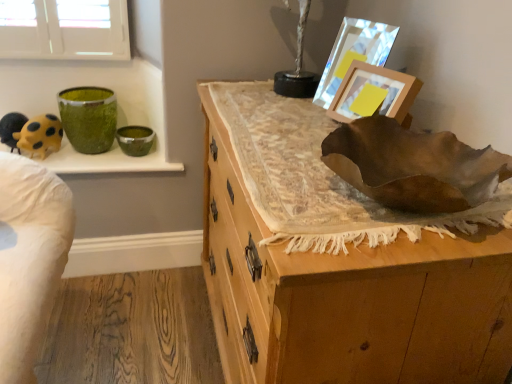
Measure the distance between point (27,150) and camera.

They are 1.55 meters apart.

Locate an element on the screen. The image size is (512, 384). green textured vase at upper left is located at coordinates (88, 118).

Locate an element on the screen. Image resolution: width=512 pixels, height=384 pixels. wooden picture frame at upper right, the second picture frame from the back is located at coordinates (375, 91).

Describe the element at coordinates (135, 140) in the screenshot. I see `green glossy bowl at upper left` at that location.

Locate an element on the screen. This screenshot has width=512, height=384. yellow matte toy at upper left is located at coordinates (40, 135).

Is green textured vase at upper left closer to the viewer compared to wooden chest of drawers at center?

No, it is not.

Is point (63, 115) closer or farther from the camera than point (277, 311)?

Point (63, 115) is positioned farther from the camera compared to point (277, 311).

Considering the relative sizes of green textured vase at upper left and wooden chest of drawers at center in the image provided, is green textured vase at upper left thinner than wooden chest of drawers at center?

Indeed, green textured vase at upper left has a lesser width compared to wooden chest of drawers at center.

Can you tell me how much green textured vase at upper left and wooden chest of drawers at center differ in facing direction?

The angular difference between green textured vase at upper left and wooden chest of drawers at center is 89.4 degrees.

Considering the sizes of objects green glossy bowl at upper left and yellow matte toy at upper left in the image provided, who is thinner, green glossy bowl at upper left or yellow matte toy at upper left?

green glossy bowl at upper left is thinner.

In the scene shown: Could you tell me if green glossy bowl at upper left is facing yellow matte toy at upper left?

No.

At what (x,y) coordinates should I click in order to perform the action: click on glass bowl that appears on the left of wooden chest of drawers at center. Please return your answer as a coordinate pair (x, y). The image size is (512, 384). Looking at the image, I should click on click(x=135, y=140).

Is green glossy bowl at upper left turned away from wooden chest of drawers at center?

No.

Considering the sizes of objects green glossy bowl at upper left and wooden chest of drawers at center in the image provided, who is bigger, green glossy bowl at upper left or wooden chest of drawers at center?

With larger size is wooden chest of drawers at center.

From a real-world perspective, which is physically above, green glossy bowl at upper left or wooden chest of drawers at center?

In real-world perspective, green glossy bowl at upper left is above.

From a real-world perspective, is green textured vase at upper left above or below wooden picture frame at upper right, the second picture frame from the back?

green textured vase at upper left is situated lower than wooden picture frame at upper right, the second picture frame from the back, in the real world.

Considering the sizes of green textured vase at upper left and wooden picture frame at upper right, the first picture frame positioned from the front, in the image, is green textured vase at upper left taller or shorter than wooden picture frame at upper right, the first picture frame positioned from the front,?

Considering their sizes, green textured vase at upper left has more height than wooden picture frame at upper right, the first picture frame positioned from the front.

Looking at this image, could you tell me if green textured vase at upper left is facing wooden picture frame at upper right, the first picture frame positioned from the front?

No, green textured vase at upper left does not turn towards wooden picture frame at upper right, the first picture frame positioned from the front.

Can you confirm if green textured vase at upper left is positioned to the left of wooden picture frame at upper right, the first picture frame positioned from the front?

Correct, you'll find green textured vase at upper left to the left of wooden picture frame at upper right, the first picture frame positioned from the front.

Considering the sizes of wooden chest of drawers at center and metallic reflective picture frame at upper right, which is counted as the 1th picture frame, starting from the back, in the image, is wooden chest of drawers at center wider or thinner than metallic reflective picture frame at upper right, which is counted as the 1th picture frame, starting from the back,?

Clearly, wooden chest of drawers at center has more width compared to metallic reflective picture frame at upper right, which is counted as the 1th picture frame, starting from the back.

Which is closer to the camera, [457,227] or [341,79]?

Positioned in front is point [457,227].

Is wooden chest of drawers at center in contact with metallic reflective picture frame at upper right, which is counted as the 1th picture frame, starting from the back?

No, wooden chest of drawers at center is not with metallic reflective picture frame at upper right, which is counted as the 1th picture frame, starting from the back.

Is wooden chest of drawers at center surrounding metallic reflective picture frame at upper right, which is counted as the 1th picture frame, starting from the back?

Actually, metallic reflective picture frame at upper right, which is counted as the 1th picture frame, starting from the back, is outside wooden chest of drawers at center.

Considering the sizes of objects yellow matte toy at upper left and wooden chest of drawers at center in the image provided, who is bigger, yellow matte toy at upper left or wooden chest of drawers at center?

Bigger between the two is wooden chest of drawers at center.

In the scene shown: Is yellow matte toy at upper left taller than wooden chest of drawers at center?

In fact, yellow matte toy at upper left may be shorter than wooden chest of drawers at center.

Is yellow matte toy at upper left oriented towards wooden chest of drawers at center?

No, yellow matte toy at upper left is not turned towards wooden chest of drawers at center.

From the image's perspective, is yellow matte toy at upper left located above or below wooden chest of drawers at center?

yellow matte toy at upper left is situated higher than wooden chest of drawers at center in the image.

From the image's perspective, is metallic reflective picture frame at upper right, which is counted as the 1th picture frame, starting from the back, positioned above or below wooden picture frame at upper right, the second picture frame from the back?

From the image's perspective, metallic reflective picture frame at upper right, which is counted as the 1th picture frame, starting from the back, appears above wooden picture frame at upper right, the second picture frame from the back.

Can you confirm if metallic reflective picture frame at upper right, which appears as the 2th picture frame when viewed from the front, is smaller than wooden picture frame at upper right, the second picture frame from the back?

Actually, metallic reflective picture frame at upper right, which appears as the 2th picture frame when viewed from the front, might be larger than wooden picture frame at upper right, the second picture frame from the back.

Can you see metallic reflective picture frame at upper right, which is counted as the 1th picture frame, starting from the back, touching wooden picture frame at upper right, the first picture frame positioned from the front?

They are not placed beside each other.

Where is `chest of drawers on the right of green textured vase at upper left`? chest of drawers on the right of green textured vase at upper left is located at coordinates (340, 261).

The width and height of the screenshot is (512, 384). Identify the location of animal in front of the green glossy bowl at upper left. (40, 135).

From the image, which object appears to be farther from yellow matte toy at upper left, green textured vase at upper left or wooden picture frame at upper right, the first picture frame positioned from the front?

Among the two, wooden picture frame at upper right, the first picture frame positioned from the front, is located further to yellow matte toy at upper left.

Which object lies further to the anchor point metallic reflective picture frame at upper right, which appears as the 2th picture frame when viewed from the front, green textured vase at upper left or green glossy bowl at upper left?

green textured vase at upper left lies further to metallic reflective picture frame at upper right, which appears as the 2th picture frame when viewed from the front, than the other object.

Looking at the image, which one is located closer to metallic reflective picture frame at upper right, which is counted as the 1th picture frame, starting from the back, green textured vase at upper left or wooden picture frame at upper right, the second picture frame from the back?

The object closer to metallic reflective picture frame at upper right, which is counted as the 1th picture frame, starting from the back, is wooden picture frame at upper right, the second picture frame from the back.

From the image, which object appears to be nearer to wooden picture frame at upper right, the first picture frame positioned from the front, metallic reflective picture frame at upper right, which appears as the 2th picture frame when viewed from the front, or green glossy bowl at upper left?

metallic reflective picture frame at upper right, which appears as the 2th picture frame when viewed from the front.

From the image, which object appears to be nearer to wooden chest of drawers at center, green glossy bowl at upper left or metallic reflective picture frame at upper right, which appears as the 2th picture frame when viewed from the front?

metallic reflective picture frame at upper right, which appears as the 2th picture frame when viewed from the front, is closer to wooden chest of drawers at center.

When comparing their distances from wooden chest of drawers at center, does yellow matte toy at upper left or metallic reflective picture frame at upper right, which appears as the 2th picture frame when viewed from the front, seem closer?

metallic reflective picture frame at upper right, which appears as the 2th picture frame when viewed from the front, is positioned closer to the anchor wooden chest of drawers at center.

When comparing their distances from yellow matte toy at upper left, does wooden chest of drawers at center or wooden picture frame at upper right, the second picture frame from the back, seem further?

Among the two, wooden picture frame at upper right, the second picture frame from the back, is located further to yellow matte toy at upper left.

Based on their spatial positions, is yellow matte toy at upper left or wooden chest of drawers at center closer to metallic reflective picture frame at upper right, which is counted as the 1th picture frame, starting from the back?

wooden chest of drawers at center lies closer to metallic reflective picture frame at upper right, which is counted as the 1th picture frame, starting from the back, than the other object.

Where is `picture frame between green textured vase at upper left and wooden picture frame at upper right, the first picture frame positioned from the front, from left to right`? Image resolution: width=512 pixels, height=384 pixels. picture frame between green textured vase at upper left and wooden picture frame at upper right, the first picture frame positioned from the front, from left to right is located at coordinates (354, 53).

At what (x,y) coordinates should I click in order to perform the action: click on animal between wooden chest of drawers at center and green glossy bowl at upper left from front to back. Please return your answer as a coordinate pair (x, y). Looking at the image, I should click on (40, 135).

Where is `picture frame between green glossy bowl at upper left and wooden picture frame at upper right, the first picture frame positioned from the front`? Image resolution: width=512 pixels, height=384 pixels. picture frame between green glossy bowl at upper left and wooden picture frame at upper right, the first picture frame positioned from the front is located at coordinates (354, 53).

Where is `picture frame that lies between metallic reflective picture frame at upper right, which appears as the 2th picture frame when viewed from the front, and wooden chest of drawers at center from top to bottom`? Image resolution: width=512 pixels, height=384 pixels. picture frame that lies between metallic reflective picture frame at upper right, which appears as the 2th picture frame when viewed from the front, and wooden chest of drawers at center from top to bottom is located at coordinates (375, 91).